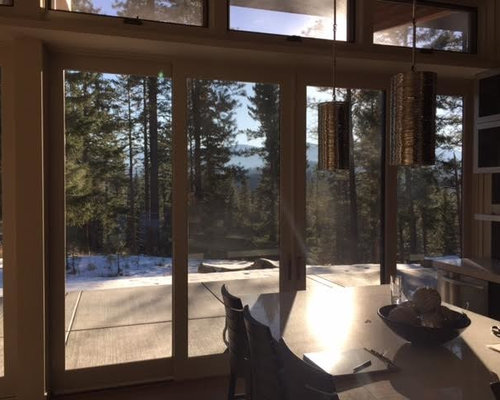
What are the coordinates of `door handle` in the screenshot? It's located at (301, 259), (291, 268).